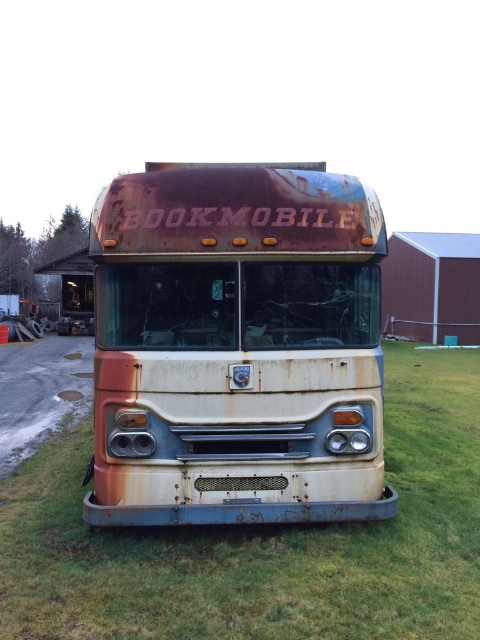
Between rusty metal bookmobile at center and rusty metal bus at center, which one has less height?

rusty metal bus at center is shorter.

Is point (109, 182) positioned before point (21, 470)?

Yes, point (109, 182) is closer to viewer.

This screenshot has width=480, height=640. What do you see at coordinates (237, 346) in the screenshot?
I see `rusty metal bookmobile at center` at bounding box center [237, 346].

The height and width of the screenshot is (640, 480). I want to click on rusty metal bookmobile at center, so click(x=237, y=346).